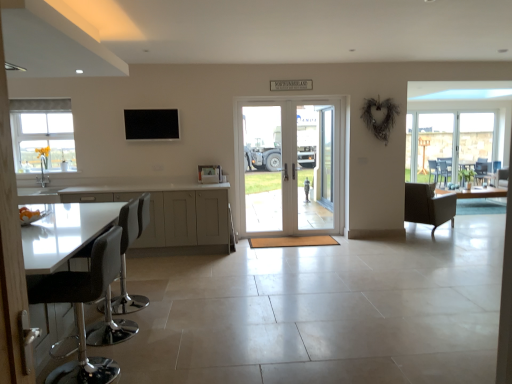
This screenshot has height=384, width=512. What do you see at coordinates (83, 308) in the screenshot? I see `black leather stool at lower left, the 3th chair when ordered from back to front` at bounding box center [83, 308].

What do you see at coordinates (428, 205) in the screenshot? The image size is (512, 384). I see `leather-like brown chair at right, which is the first chair from right to left` at bounding box center [428, 205].

What is the approximate height of white frosted glass window at upper left?

white frosted glass window at upper left is 38.09 inches in height.

Where is `black leather bar stool at left, the 3th chair positioned from the right`? The image size is (512, 384). black leather bar stool at left, the 3th chair positioned from the right is located at coordinates click(122, 280).

Based on the photo, considering the sizes of white glossy door at center and black leather stool at lower left, the 3th chair when ordered from back to front, in the image, is white glossy door at center wider or thinner than black leather stool at lower left, the 3th chair when ordered from back to front,?

In the image, white glossy door at center appears to be more narrow than black leather stool at lower left, the 3th chair when ordered from back to front.

From the image's perspective, which is above, white glossy door at center or black leather stool at lower left, arranged as the 2th chair when viewed from the left?

From the image's view, white glossy door at center is above.

Is white glossy door at center outside of black leather stool at lower left, arranged as the 2th chair when viewed from the left?

white glossy door at center lies outside black leather stool at lower left, arranged as the 2th chair when viewed from the left,'s area.

Does white glossy door at center lie in front of black leather stool at lower left, arranged as the 2th chair when viewed from the left?

No, the depth of white glossy door at center is greater than that of black leather stool at lower left, arranged as the 2th chair when viewed from the left.

Which is behind, point (65, 375) or point (274, 118)?

The point (274, 118) is behind.

Is clear glass door at center, which is the second screen door from right to left, located within black leather stool at lower left, arranged as the 2th chair when viewed from the left?

No.

Measure the distance from black leather stool at lower left, marked as the second chair in a right-to-left arrangement, to clear glass door at center, the first screen door in the left-to-right sequence.

black leather stool at lower left, marked as the second chair in a right-to-left arrangement, is 3.62 meters from clear glass door at center, the first screen door in the left-to-right sequence.

Which chair is the 2nd one when counting from the front of the clear glass door at center, which is the second screen door from right to left? Please provide its 2D coordinates.

[(83, 308)]

Looking at this image, considering the sizes of objects black leather stool at lower left, marked as the second chair in a right-to-left arrangement, and white frosted glass window at upper left in the image provided, who is thinner, black leather stool at lower left, marked as the second chair in a right-to-left arrangement, or white frosted glass window at upper left?

With smaller width is white frosted glass window at upper left.

Is black leather stool at lower left, arranged as the first chair when viewed from the front, in contact with white frosted glass window at upper left?

black leather stool at lower left, arranged as the first chair when viewed from the front, and white frosted glass window at upper left are clearly separated.

How far apart are black leather stool at lower left, marked as the second chair in a right-to-left arrangement, and white frosted glass window at upper left?

4.26 meters.

From a real-world perspective, which object stands above the other?

In real-world perspective, white frosted glass window at upper left is above.

Does black matte tv at upper center turn towards clear glass door at center, arranged as the 1th screen door when viewed from the right?

No, black matte tv at upper center is not facing towards clear glass door at center, arranged as the 1th screen door when viewed from the right.

Would you say clear glass door at center, arranged as the 1th screen door when viewed from the right, is part of black matte tv at upper center's contents?

Actually, clear glass door at center, arranged as the 1th screen door when viewed from the right, is outside black matte tv at upper center.

Does point (151, 121) come in front of point (322, 217)?

Yes.

How distant is black matte tv at upper center from clear glass door at center, arranged as the 1th screen door when viewed from the right?

6.85 feet.

From the image's perspective, does clear glass door at center, which is the second screen door from right to left, appear lower than black matte tv at upper center?

Yes, from the image's perspective, clear glass door at center, which is the second screen door from right to left, is beneath black matte tv at upper center.

From their relative heights in the image, would you say clear glass door at center, which is the second screen door from right to left, is taller or shorter than black matte tv at upper center?

Considering their sizes, clear glass door at center, which is the second screen door from right to left, has more height than black matte tv at upper center.

From a real-world perspective, which is physically below, clear glass door at center, the first screen door in the left-to-right sequence, or black matte tv at upper center?

In real-world perspective, clear glass door at center, the first screen door in the left-to-right sequence, is lower.

In terms of width, does clear glass door at center, which is the second screen door from right to left, look wider or thinner when compared to black matte tv at upper center?

In the image, clear glass door at center, which is the second screen door from right to left, appears to be more narrow than black matte tv at upper center.

I want to click on the 1st screen door directly above the white glossy cabinets at lower left (from a real-world perspective), so click(263, 167).

Can you confirm if white glossy cabinets at lower left is bigger than clear glass door at center, the first screen door in the left-to-right sequence?

Correct, white glossy cabinets at lower left is larger in size than clear glass door at center, the first screen door in the left-to-right sequence.

Is white glossy cabinets at lower left a part of white glossy door at center?

No.

Considering the positions of objects white glossy door at center and white glossy cabinets at lower left in the image provided, who is in front, white glossy door at center or white glossy cabinets at lower left?

Positioned in front is white glossy cabinets at lower left.

From a real-world perspective, relative to white glossy cabinets at lower left, is white glossy door at center vertically above or below?

white glossy door at center is above white glossy cabinets at lower left.

Is white glossy door at center wider than white glossy cabinets at lower left?

Incorrect, the width of white glossy door at center does not surpass that of white glossy cabinets at lower left.

Locate an element on the screen. Image resolution: width=512 pixels, height=384 pixels. door behind the black leather stool at lower left, marked as the second chair in a right-to-left arrangement is located at coordinates (290, 165).

I want to click on the 1st screen door above the black leather stool at lower left, the 3th chair when ordered from back to front (from the image's perspective), so coord(263,167).

Which object lies further to the anchor point black leather bar stool at left, which is the first chair in left-to-right order, clear glass door at center, the first screen door in the left-to-right sequence, or white frosted glass window at upper left?

Based on the image, white frosted glass window at upper left appears to be further to black leather bar stool at left, which is the first chair in left-to-right order.

When comparing their distances from white glossy cabinets at lower left, does black leather bar stool at left, placed as the second chair when sorted from back to front, or black leather stool at lower left, the 3th chair when ordered from back to front, seem further?

The object further to white glossy cabinets at lower left is black leather stool at lower left, the 3th chair when ordered from back to front.

Considering their positions, is white glossy door at center positioned further to white glossy cabinets at lower left than white frosted glass window at upper left?

Among the two, white glossy door at center is located further to white glossy cabinets at lower left.

Which object lies nearer to the anchor point black matte tv at upper center, leather-like brown chair at right, which is the first chair from right to left, or white glossy door at center?

white glossy door at center lies closer to black matte tv at upper center than the other object.

Looking at the image, which one is located closer to clear glass door at center, which is the second screen door from right to left, white glossy cabinets at lower left or black leather stool at lower left, marked as the second chair in a right-to-left arrangement?

white glossy cabinets at lower left is positioned closer to the anchor clear glass door at center, which is the second screen door from right to left.

Based on their spatial positions, is black matte tv at upper center or clear glass door at center, arranged as the 1th screen door when viewed from the right, further from white frosted glass window at upper left?

clear glass door at center, arranged as the 1th screen door when viewed from the right, is further to white frosted glass window at upper left.

From the image, which object appears to be nearer to white glossy door at center, black leather stool at lower left, arranged as the 2th chair when viewed from the left, or black matte tv at upper center?

Based on the image, black matte tv at upper center appears to be nearer to white glossy door at center.

Which object lies further to the anchor point white glossy door at center, clear glass door at center, which is counted as the 2th screen door, starting from the left, or black matte tv at upper center?

Among the two, black matte tv at upper center is located further to white glossy door at center.

Identify the location of door located between black leather stool at lower left, marked as the second chair in a right-to-left arrangement, and leather-like brown chair at right, the 1th chair from the back, in the depth direction. (290, 165).

Locate an element on the screen. This screenshot has height=384, width=512. screen door located between black leather bar stool at left, placed as the second chair when sorted from back to front, and clear glass door at center, arranged as the 1th screen door when viewed from the right, in the depth direction is located at coordinates (263, 167).

Identify the location of screen door between black leather stool at lower left, arranged as the 2th chair when viewed from the left, and white glossy door at center in the front-back direction. The height and width of the screenshot is (384, 512). (263, 167).

Locate an element on the screen. window screen between white frosted glass window at upper left and clear glass door at center, the first screen door in the left-to-right sequence is located at coordinates coord(151,124).